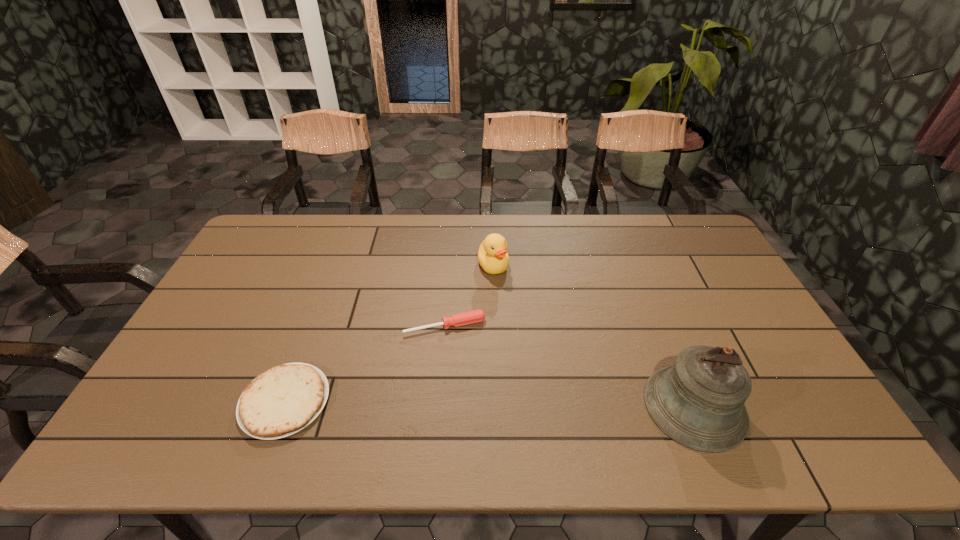
Locate an element on the screen. vacant space on the desktop that is between the tortilla and the tallest object and is positioned at the beak of the second tallest object is located at coordinates tap(542, 404).

In order to click on free spot on the desktop that is between the leftmost object and the bell and is positioned at the blade of the screwdriver in this screenshot , I will do `click(468, 403)`.